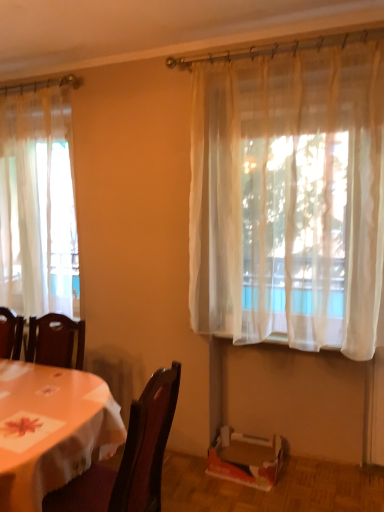
Question: Is dark wood chair at lower left to the left of cardboard box at lower right from the viewer's perspective?

Choices:
 (A) no
 (B) yes

Answer: (B)

Question: Is dark wood chair at lower left facing away from cardboard box at lower right?

Choices:
 (A) yes
 (B) no

Answer: (B)

Question: Does dark wood chair at lower left turn towards cardboard box at lower right?

Choices:
 (A) yes
 (B) no

Answer: (B)

Question: Would you consider dark wood chair at lower left to be distant from cardboard box at lower right?

Choices:
 (A) no
 (B) yes

Answer: (A)

Question: Considering the relative positions of dark wood chair at lower left and cardboard box at lower right in the image provided, is dark wood chair at lower left to the right of cardboard box at lower right from the viewer's perspective?

Choices:
 (A) yes
 (B) no

Answer: (B)

Question: Does point tap(266, 438) appear closer or farther from the camera than point tap(49, 487)?

Choices:
 (A) closer
 (B) farther

Answer: (B)

Question: From the image's perspective, is cardboard box at lower right above or below wooden table at lower left?

Choices:
 (A) below
 (B) above

Answer: (A)

Question: Considering the positions of cardboard box at lower right and wooden table at lower left in the image, is cardboard box at lower right bigger or smaller than wooden table at lower left?

Choices:
 (A) big
 (B) small

Answer: (B)

Question: Do you think cardboard box at lower right is within wooden table at lower left, or outside of it?

Choices:
 (A) outside
 (B) inside

Answer: (A)

Question: In terms of width, does wooden table at lower left look wider or thinner when compared to sheer white curtain at upper right, the 1th curtain positioned from the front?

Choices:
 (A) wide
 (B) thin

Answer: (A)

Question: Considering the positions of wooden table at lower left and sheer white curtain at upper right, placed as the second curtain when sorted from back to front, in the image, is wooden table at lower left bigger or smaller than sheer white curtain at upper right, placed as the second curtain when sorted from back to front,?

Choices:
 (A) small
 (B) big

Answer: (B)

Question: From a real-world perspective, relative to sheer white curtain at upper right, which is the 2th curtain from left to right, is wooden table at lower left vertically above or below?

Choices:
 (A) above
 (B) below

Answer: (B)

Question: Is point (34, 396) closer or farther from the camera than point (258, 333)?

Choices:
 (A) farther
 (B) closer

Answer: (B)

Question: Is point [x=44, y=376] positioned closer to the camera than point [x=41, y=121]?

Choices:
 (A) farther
 (B) closer

Answer: (B)

Question: In the image, is wooden table at lower left on the left side or the right side of sheer white curtain at left, which appears as the 2th curtain when viewed from the front?

Choices:
 (A) left
 (B) right

Answer: (B)